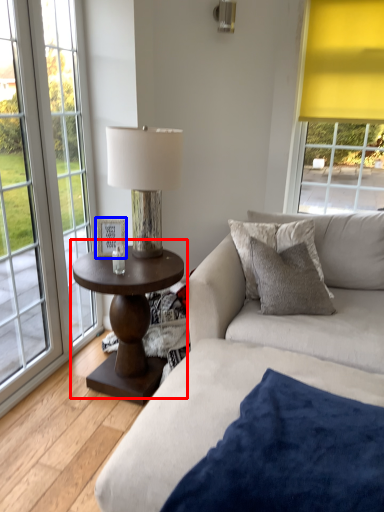
Question: Which of the following is the closest to the observer, coffee table (highlighted by a red box) or picture frame (highlighted by a blue box)?

Choices:
 (A) coffee table
 (B) picture frame

Answer: (A)